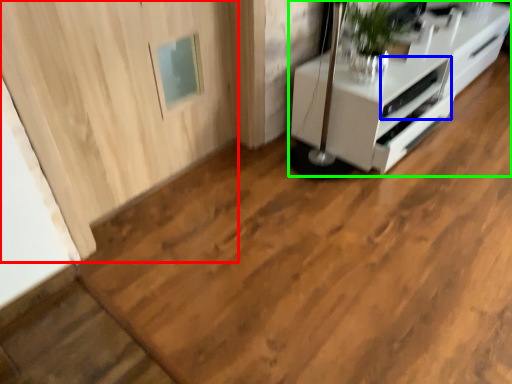
Question: Estimate the real-world distances between objects in this image. Which object is closer to door (highlighted by a red box), appliance (highlighted by a blue box) or furniture (highlighted by a green box)?

Choices:
 (A) appliance
 (B) furniture

Answer: (B)